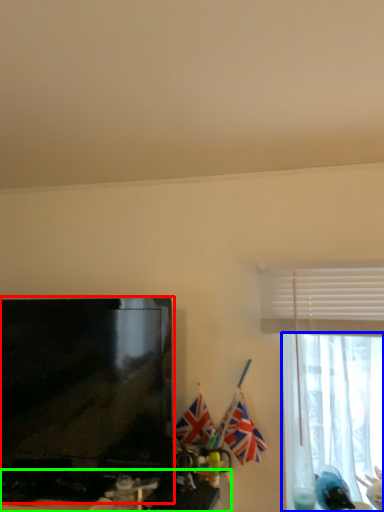
Question: Which object is the farthest from television (highlighted by a red box)? Choose among these: curtain (highlighted by a blue box) or computer desk (highlighted by a green box).

Choices:
 (A) curtain
 (B) computer desk

Answer: (A)